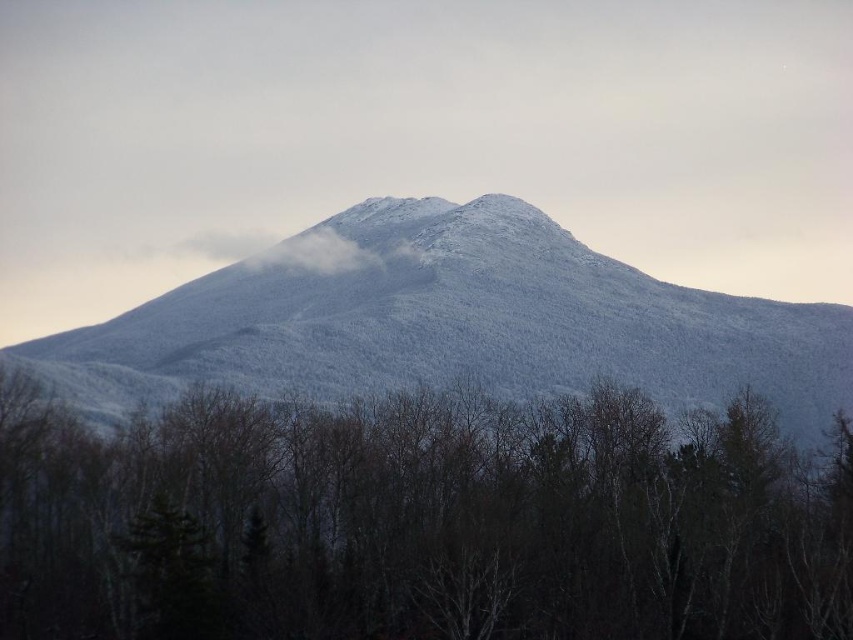
You are an observer looking at the mountain scene. You see a white matte tree at center and a white frosty mountain at center. Which object is positioned to the right of the other?

The white matte tree at center is to the right of the white frosty mountain at center.

You are a drone operator trying to capture a photo of the white frosty mountain at center. Your drone can fly up to 15 meters high. Can your drone reach the white fluffy cloud at upper center to get a clear shot of the mountain?

The distance between the white frosty mountain at center and the white fluffy cloud at upper center is 16.11 meters. Since the drone can only fly up to 15 meters, it cannot reach the cloud to get the shot.

You are an observer looking at the mountain scene. You notice a white matte tree at center and a white fluffy cloud at upper center. Which object is positioned closer to you?

The white matte tree at center is closer to the viewer than the white fluffy cloud at upper center.